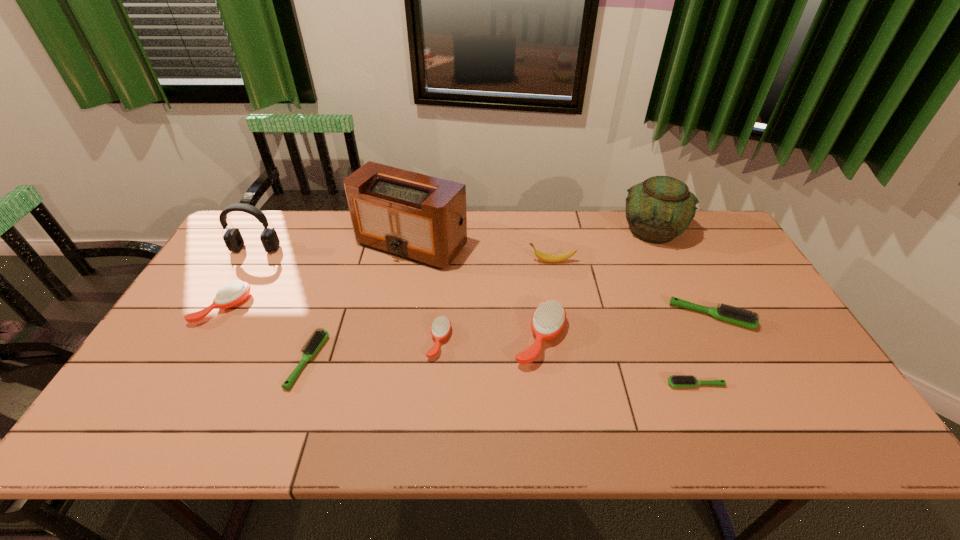
Where is `vacant region at the far left corner of the desktop`? The image size is (960, 540). vacant region at the far left corner of the desktop is located at coordinates pyautogui.click(x=255, y=231).

Locate an element on the screen. This screenshot has width=960, height=540. empty location between the radio receiver and the second smallest light hairbrush is located at coordinates (360, 302).

Where is `blank region between the leftmost light hairbrush and the second orange hairbrush from right to left`? The width and height of the screenshot is (960, 540). blank region between the leftmost light hairbrush and the second orange hairbrush from right to left is located at coordinates (373, 351).

Locate an element on the screen. The image size is (960, 540). vacant space that's between the tallest hairbrush and the smallest light hairbrush is located at coordinates (617, 361).

In order to click on empty location between the second shortest hairbrush and the second biggest orange hairbrush in this screenshot , I will do `click(266, 334)`.

The width and height of the screenshot is (960, 540). I want to click on vacant space that is in between the radio receiver and the second orange hairbrush from left to right, so (x=425, y=293).

This screenshot has height=540, width=960. What are the coordinates of `empty space that is in between the radio receiver and the pottery` in the screenshot? It's located at (532, 238).

Locate an element on the screen. free space that is in between the fourth hairbrush from right to left and the radio receiver is located at coordinates (425, 293).

Where is `blank region between the headset and the biggest light hairbrush`? blank region between the headset and the biggest light hairbrush is located at coordinates (484, 282).

This screenshot has height=540, width=960. What are the coordinates of `empty space that is in between the second orange hairbrush from left to right and the shortest object` in the screenshot? It's located at (567, 363).